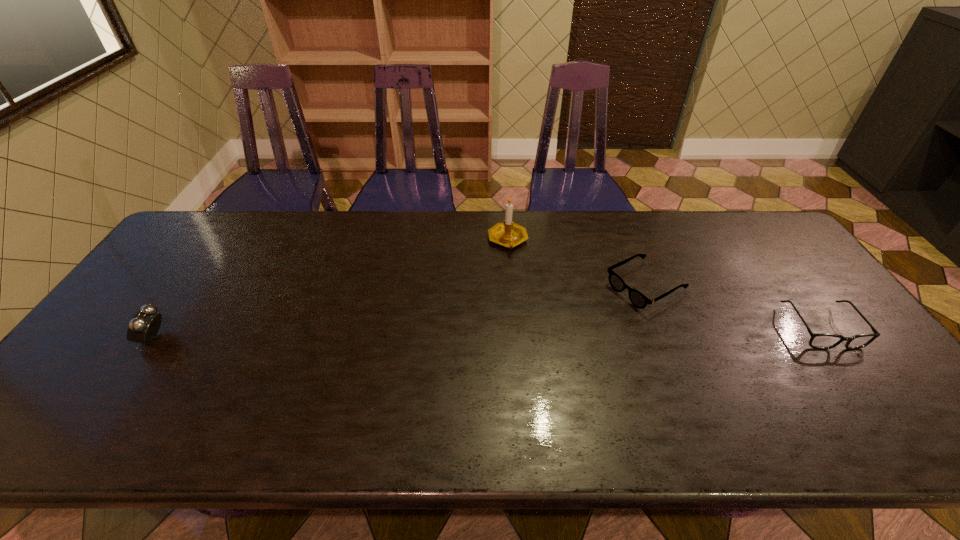
Locate an element on the screen. This screenshot has height=540, width=960. the second tallest object is located at coordinates pos(144,326).

Where is `the leftmost object`? The height and width of the screenshot is (540, 960). the leftmost object is located at coordinates (144, 326).

Locate an element on the screen. the right spectacles is located at coordinates (818, 341).

Find the location of a particular element. the left spectacles is located at coordinates (639, 300).

Locate an element on the screen. the farthest object is located at coordinates (509, 234).

Find the location of a particular element. This screenshot has height=540, width=960. the tallest object is located at coordinates (509, 234).

Where is `vacant space situated on the face of the alarm clock`? vacant space situated on the face of the alarm clock is located at coordinates (106, 339).

At what (x,y) coordinates should I click in order to perform the action: click on vacant space located on the face of the alarm clock. Please return your answer as a coordinate pair (x, y). Looking at the image, I should click on pyautogui.click(x=113, y=339).

Identify the location of vacant position located 0.150m on the front-facing side of the rightmost object. (877, 404).

The height and width of the screenshot is (540, 960). Identify the location of vacant space located 0.060m on the arms of the second object from right to left. [601, 310].